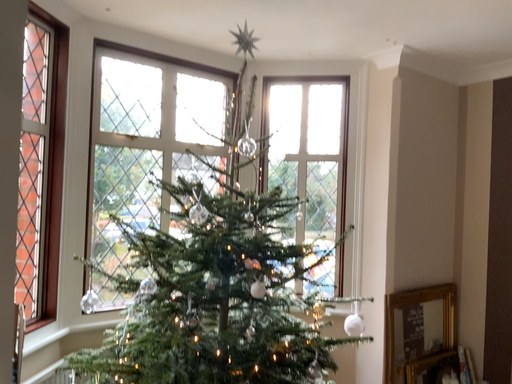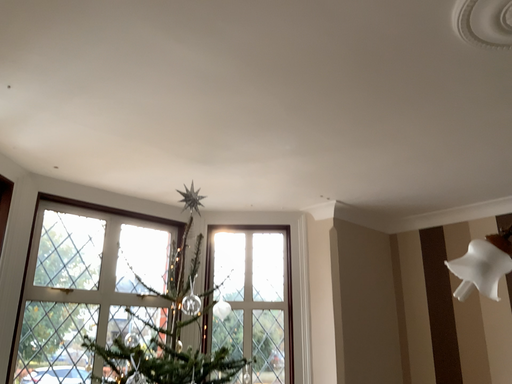
Question: How did the camera likely rotate when shooting the video?

Choices:
 (A) rotated upward
 (B) rotated downward

Answer: (A)